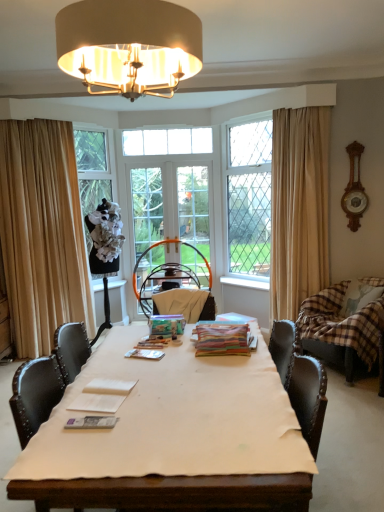
Where is `vacant space to the right of matte white magazine at center, the 3th magazine from the right`? The width and height of the screenshot is (384, 512). vacant space to the right of matte white magazine at center, the 3th magazine from the right is located at coordinates (140, 433).